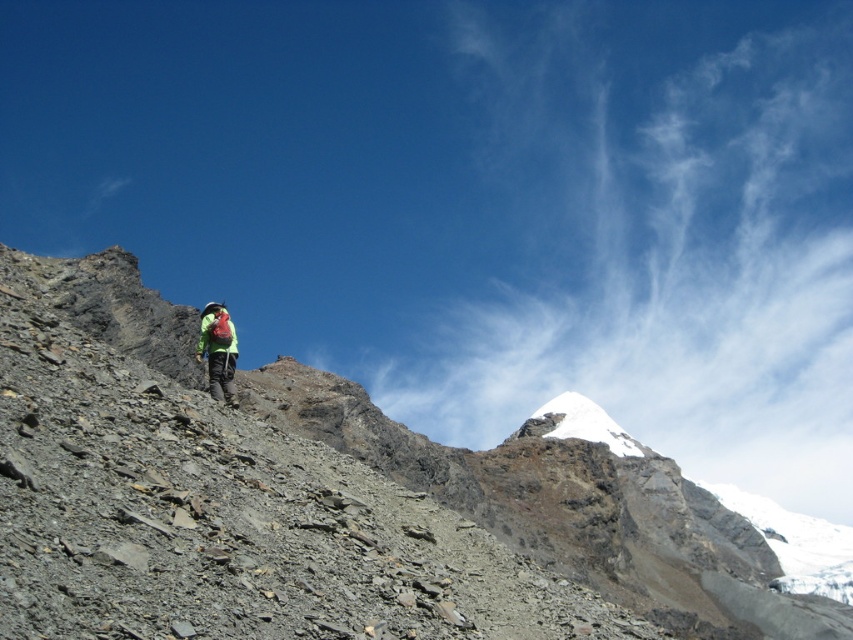
Who is lower down, rugged stone mountain at center or white snow-covered peak at center?

white snow-covered peak at center is lower down.

Locate an element on the screen. The image size is (853, 640). rugged stone mountain at center is located at coordinates (294, 499).

Find the location of a particular element. rugged stone mountain at center is located at coordinates (294, 499).

Does rugged stone mountain at center have a smaller size compared to green fabric backpack at center?

Actually, rugged stone mountain at center might be larger than green fabric backpack at center.

Is rugged stone mountain at center bigger than green fabric backpack at center?

Yes, rugged stone mountain at center is bigger than green fabric backpack at center.

Image resolution: width=853 pixels, height=640 pixels. Identify the location of rugged stone mountain at center. (294, 499).

In the scene shown: Does white snow-covered peak at center have a lesser width compared to green fabric backpack at center?

Incorrect, white snow-covered peak at center's width is not less than green fabric backpack at center's.

Is point (640, 456) positioned after point (230, 348)?

Yes, point (640, 456) is behind point (230, 348).

Who is more forward, (590, 417) or (222, 356)?

Point (222, 356)

You are a GUI agent. You are given a task and a screenshot of the screen. Output one action in this format:
    pyautogui.click(x=<x>, y=<y>)
    Task: Click on the white snow-covered peak at center
    The width and height of the screenshot is (853, 640).
    Given the screenshot: What is the action you would take?
    pyautogui.click(x=579, y=424)